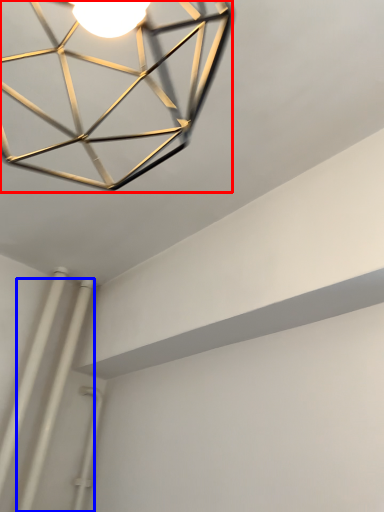
Question: Which point is closer to the camera, lamp (highlighted by a red box) or pipe (highlighted by a blue box)?

Choices:
 (A) lamp
 (B) pipe

Answer: (A)